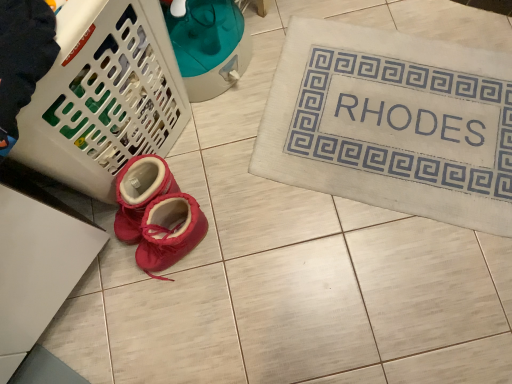
Where is `white plastic laundry basket at lower left`? white plastic laundry basket at lower left is located at coordinates (104, 96).

This screenshot has width=512, height=384. Describe the element at coordinates (155, 214) in the screenshot. I see `matte pink booties at center` at that location.

Where is `white plastic laundry basket at lower left`? white plastic laundry basket at lower left is located at coordinates (104, 96).

Does matte pink booties at center have a larger size compared to beige fabric bath mat at upper right?

No.

This screenshot has height=384, width=512. Identify the location of bath mat lying behind the matte pink booties at center. (392, 123).

What's the angular difference between matte pink booties at center and beige fabric bath mat at upper right's facing directions?

The facing directions of matte pink booties at center and beige fabric bath mat at upper right are 21 degrees apart.

Based on the photo, from the image's perspective, who appears lower, beige fabric bath mat at upper right or matte pink booties at center?

matte pink booties at center, from the image's perspective.

Is beige fabric bath mat at upper right next to matte pink booties at center?

No, beige fabric bath mat at upper right is not in contact with matte pink booties at center.

Considering the sizes of objects beige fabric bath mat at upper right and matte pink booties at center in the image provided, who is wider, beige fabric bath mat at upper right or matte pink booties at center?

beige fabric bath mat at upper right is wider.

Is beige fabric bath mat at upper right surrounding matte pink booties at center?

Definitely not — matte pink booties at center is not inside beige fabric bath mat at upper right.

Are white plastic laundry basket at lower left and matte pink booties at center located far from each other?

They are positioned close to each other.

Which point is more forward, (41,121) or (158,227)?

The point (41,121) is closer.

In the scene shown: In the image, is white plastic laundry basket at lower left on the left side or the right side of matte pink booties at center?

white plastic laundry basket at lower left is positioned on matte pink booties at center's left side.

From the image's perspective, is white plastic laundry basket at lower left over matte pink booties at center?

Correct, white plastic laundry basket at lower left appears higher than matte pink booties at center in the image.

Can you confirm if white plastic laundry basket at lower left is smaller than beige fabric bath mat at upper right?

No, white plastic laundry basket at lower left is not smaller than beige fabric bath mat at upper right.

Is point (48, 121) closer or farther from the camera than point (456, 219)?

Point (48, 121) is positioned closer to the camera compared to point (456, 219).

Is white plastic laundry basket at lower left next to beige fabric bath mat at upper right?

No, white plastic laundry basket at lower left is not with beige fabric bath mat at upper right.

Is white plastic laundry basket at lower left looking in the opposite direction of beige fabric bath mat at upper right?

That's not correct — white plastic laundry basket at lower left is not looking away from beige fabric bath mat at upper right.

Between beige fabric bath mat at upper right and white plastic laundry basket at lower left, which one has more height?

white plastic laundry basket at lower left is taller.

Does point (449, 83) lie in front of point (67, 37)?

No, (449, 83) is behind (67, 37).

Is beige fabric bath mat at upper right further to the viewer compared to white plastic laundry basket at lower left?

Yes, beige fabric bath mat at upper right is further from the camera.

Is beige fabric bath mat at upper right positioned far away from white plastic laundry basket at lower left?

No.

From the image's perspective, is matte pink booties at center on top of white plastic laundry basket at lower left?

Actually, matte pink booties at center appears below white plastic laundry basket at lower left in the image.

Which object is thinner, matte pink booties at center or white plastic laundry basket at lower left?

matte pink booties at center.

Can you confirm if matte pink booties at center is bigger than white plastic laundry basket at lower left?

Incorrect, matte pink booties at center is not larger than white plastic laundry basket at lower left.

From the picture: Is matte pink booties at center oriented away from white plastic laundry basket at lower left?

matte pink booties at center does not have its back to white plastic laundry basket at lower left.

Where is `footwear above the beige fabric bath mat at upper right (from a real-world perspective)`? footwear above the beige fabric bath mat at upper right (from a real-world perspective) is located at coordinates (155, 214).

The height and width of the screenshot is (384, 512). I want to click on footwear below the beige fabric bath mat at upper right (from the image's perspective), so click(155, 214).

Looking at the image, which one is located closer to beige fabric bath mat at upper right, white plastic laundry basket at lower left or matte pink booties at center?

Based on the image, matte pink booties at center appears to be nearer to beige fabric bath mat at upper right.

Estimate the real-world distances between objects in this image. Which object is closer to white plastic laundry basket at lower left, matte pink booties at center or beige fabric bath mat at upper right?

Among the two, matte pink booties at center is located nearer to white plastic laundry basket at lower left.

Looking at the image, which one is located closer to beige fabric bath mat at upper right, matte pink booties at center or white plastic laundry basket at lower left?

matte pink booties at center lies closer to beige fabric bath mat at upper right than the other object.

Looking at the image, which one is located closer to matte pink booties at center, beige fabric bath mat at upper right or white plastic laundry basket at lower left?

white plastic laundry basket at lower left is positioned closer to the anchor matte pink booties at center.

From the image, which object appears to be nearer to white plastic laundry basket at lower left, beige fabric bath mat at upper right or matte pink booties at center?

matte pink booties at center lies closer to white plastic laundry basket at lower left than the other object.

Which object lies further to the anchor point matte pink booties at center, white plastic laundry basket at lower left or beige fabric bath mat at upper right?

Among the two, beige fabric bath mat at upper right is located further to matte pink booties at center.

Find the location of a particular element. This screenshot has width=512, height=384. footwear between white plastic laundry basket at lower left and beige fabric bath mat at upper right in the horizontal direction is located at coordinates (155, 214).